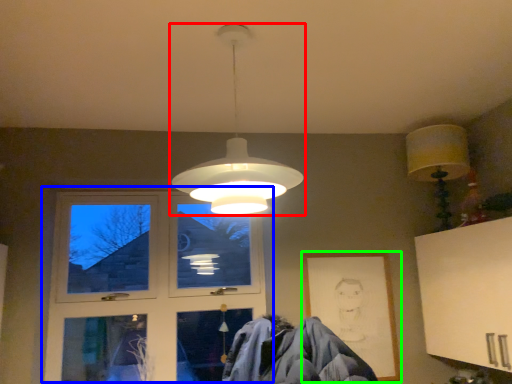
Question: Which object is positioned closest to lamp (highlighted by a red box)? Select from window (highlighted by a blue box) and picture frame (highlighted by a green box).

Choices:
 (A) window
 (B) picture frame

Answer: (B)